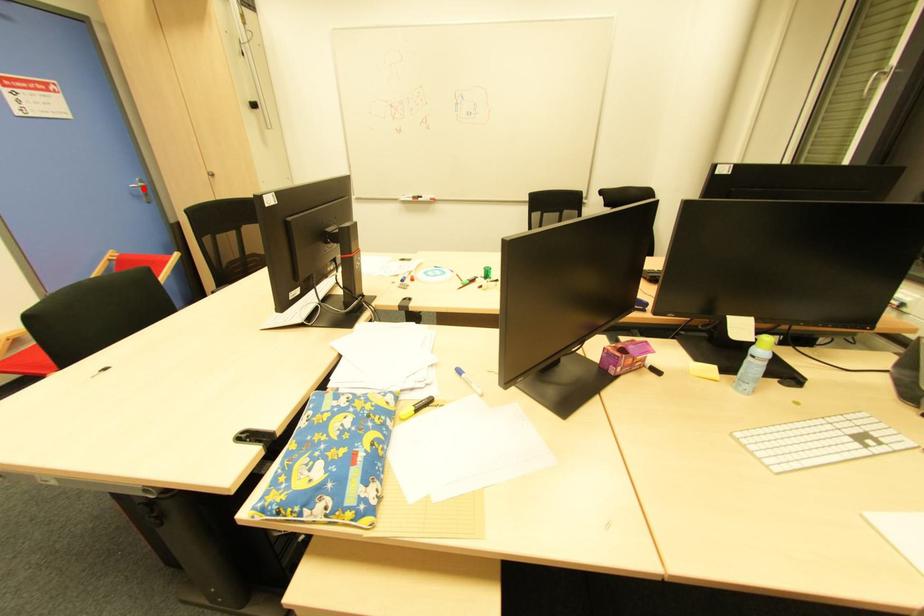
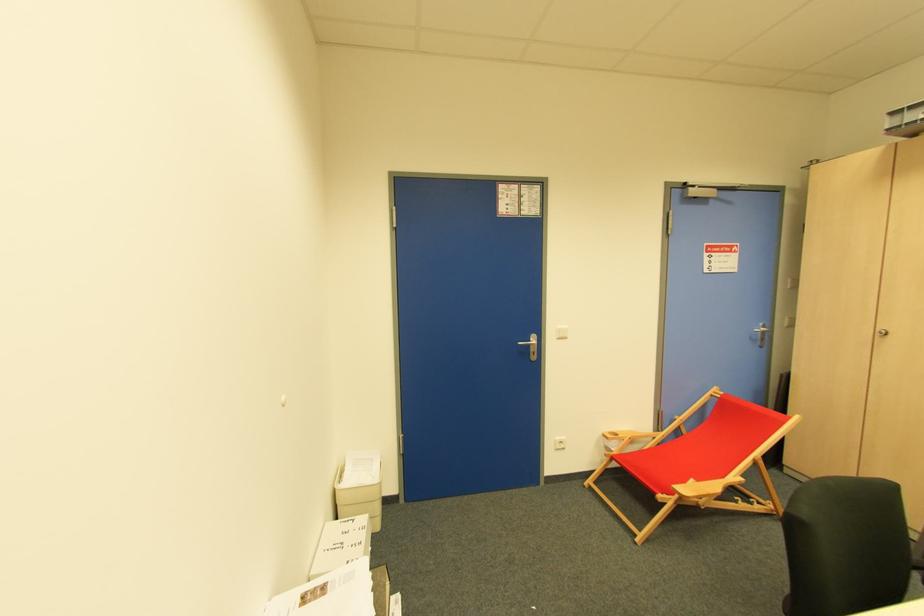
Where in the second image is the point corresponding to the highlighted location from the first image?

(763, 333)